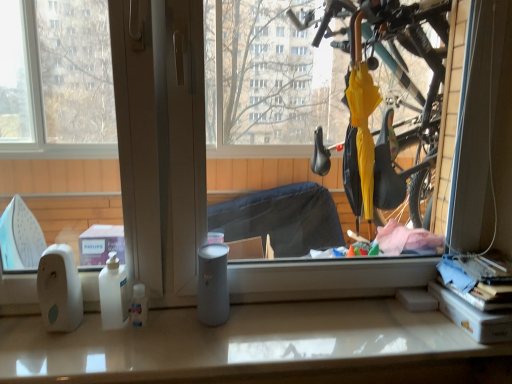
Question: Does white glossy counter top at lower center appear on the left side of transparent plastic umbrella at center?

Choices:
 (A) no
 (B) yes

Answer: (B)

Question: Is white glossy counter top at lower center in contact with transparent plastic umbrella at center?

Choices:
 (A) no
 (B) yes

Answer: (A)

Question: Is white glossy counter top at lower center at the right side of transparent plastic umbrella at center?

Choices:
 (A) no
 (B) yes

Answer: (A)

Question: Does white glossy counter top at lower center have a larger size compared to transparent plastic umbrella at center?

Choices:
 (A) yes
 (B) no

Answer: (B)

Question: Does white glossy counter top at lower center have a lesser height compared to transparent plastic umbrella at center?

Choices:
 (A) no
 (B) yes

Answer: (B)

Question: Considering the relative sizes of white glossy counter top at lower center and transparent plastic umbrella at center in the image provided, is white glossy counter top at lower center wider than transparent plastic umbrella at center?

Choices:
 (A) yes
 (B) no

Answer: (A)

Question: Is transparent plastic umbrella at center shorter than white glossy counter top at lower center?

Choices:
 (A) yes
 (B) no

Answer: (B)

Question: Can you confirm if transparent plastic umbrella at center is smaller than white glossy counter top at lower center?

Choices:
 (A) yes
 (B) no

Answer: (B)

Question: From the image's perspective, would you say transparent plastic umbrella at center is shown under white glossy counter top at lower center?

Choices:
 (A) yes
 (B) no

Answer: (B)

Question: Can you confirm if transparent plastic umbrella at center is taller than white glossy counter top at lower center?

Choices:
 (A) no
 (B) yes

Answer: (B)

Question: From the image's perspective, is transparent plastic umbrella at center on white glossy counter top at lower center?

Choices:
 (A) no
 (B) yes

Answer: (B)

Question: Are transparent plastic umbrella at center and white glossy counter top at lower center making contact?

Choices:
 (A) yes
 (B) no

Answer: (B)

Question: Is transparent plastic umbrella at center taller or shorter than white glossy counter top at lower center?

Choices:
 (A) short
 (B) tall

Answer: (B)